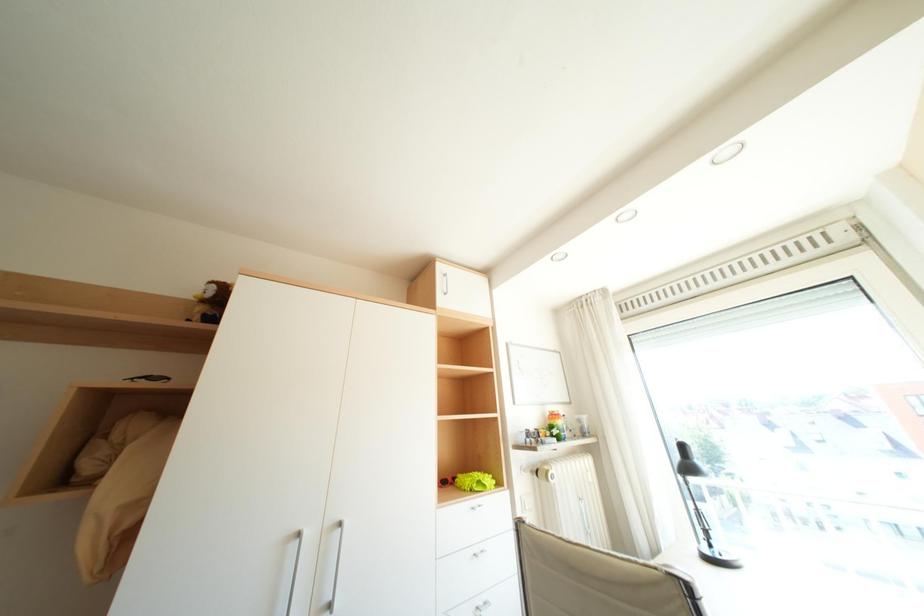
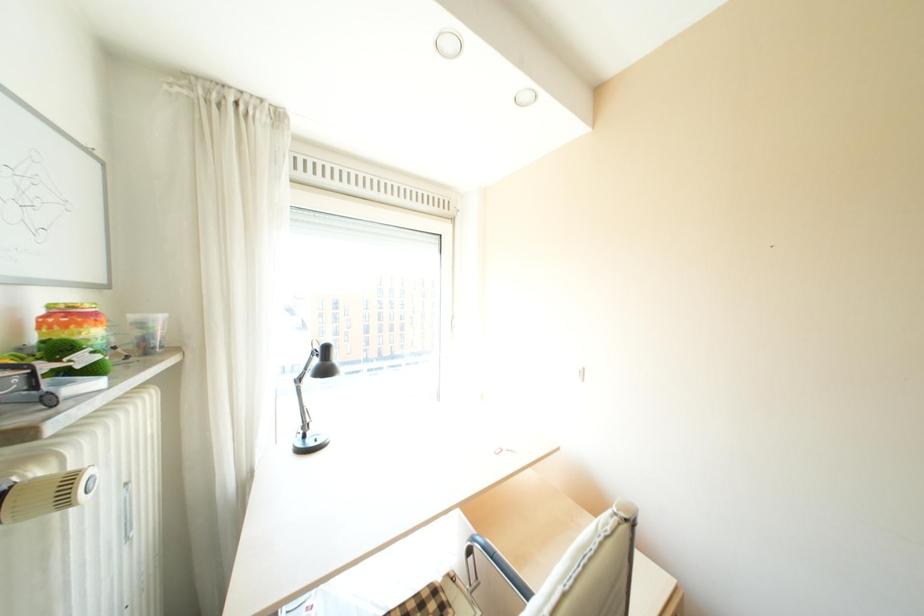
Question: The camera is either moving clockwise (left) or counter-clockwise (right) around the object. The first image is from the beginning of the video and the second image is from the end. Is the camera moving left or right when shooting the video?

Choices:
 (A) Left
 (B) Right

Answer: (A)